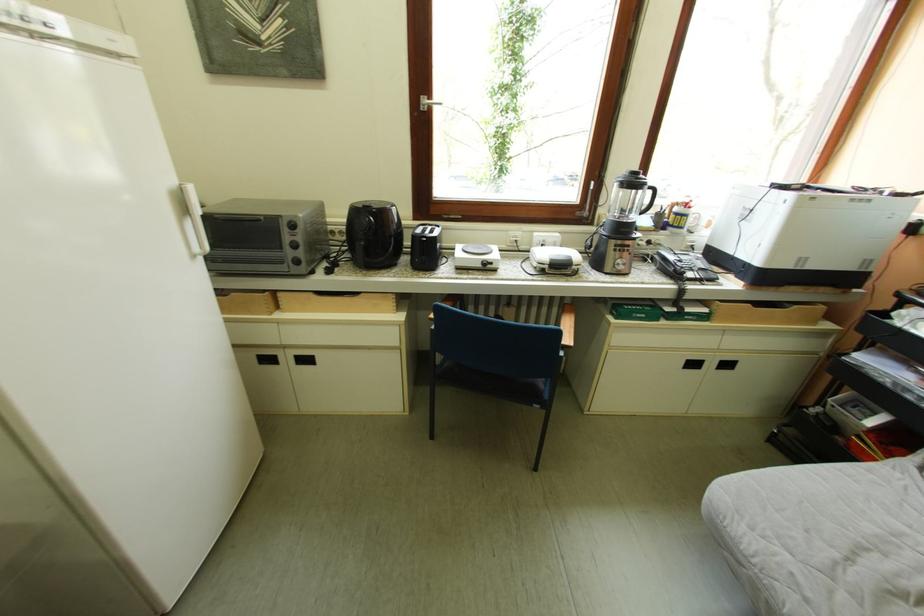
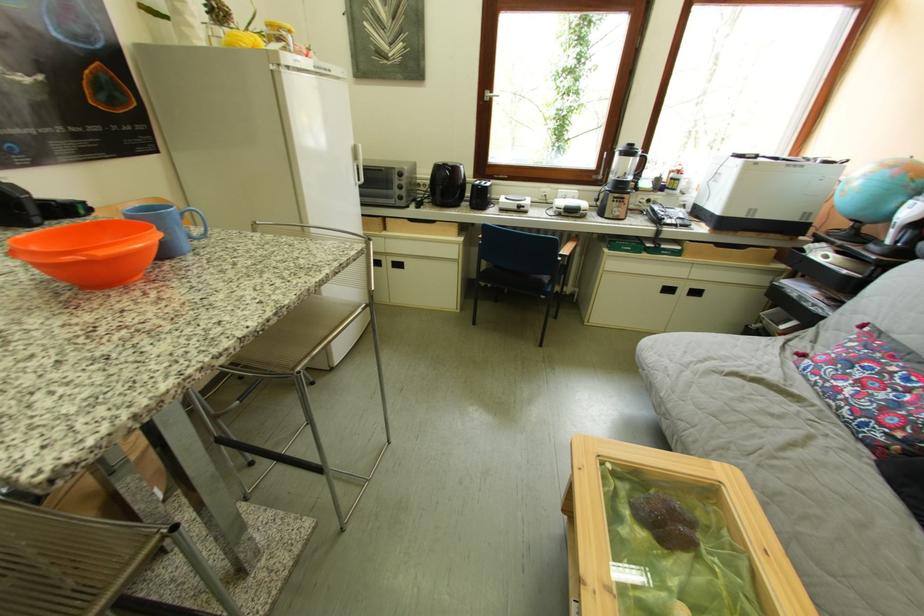
Locate, in the second image, the point that corresponds to pixel 370 216 in the first image.

(451, 171)